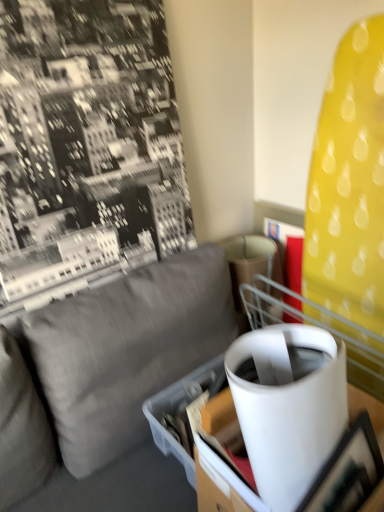
This screenshot has width=384, height=512. Describe the element at coordinates (220, 486) in the screenshot. I see `white glossy table at center` at that location.

Identify the location of matte black picture frame at lower right. This screenshot has height=512, width=384. (348, 472).

The width and height of the screenshot is (384, 512). What do you see at coordinates (182, 409) in the screenshot?
I see `cardboard box at center` at bounding box center [182, 409].

Locate an element on the screen. This screenshot has height=512, width=384. white glossy table at center is located at coordinates (220, 486).

Is white glossy table at center touching cardboard box at center?

No.

Is white glossy table at center looking in the opposite direction of cardboard box at center?

Correct, white glossy table at center is looking away from cardboard box at center.

Which is correct: white glossy table at center is inside cardboard box at center, or outside of it?

white glossy table at center lies outside cardboard box at center.

At what (x,y) coordinates should I click in order to perform the action: click on cardboard box below the white glossy table at center (from the image's perspective). Please return your answer as a coordinate pair (x, y). The width and height of the screenshot is (384, 512). Looking at the image, I should click on (182, 409).

What's the angular difference between matte black picture frame at lower right and gray fabric couch at center's facing directions?

The angle between the facing direction of matte black picture frame at lower right and the facing direction of gray fabric couch at center is 0.946 degrees.

Which is more to the right, matte black picture frame at lower right or gray fabric couch at center?

Positioned to the right is matte black picture frame at lower right.

From the picture: From the image's perspective, which one is positioned lower, matte black picture frame at lower right or gray fabric couch at center?

gray fabric couch at center is shown below in the image.

At what (x,y) coordinates should I click in order to perform the action: click on picture frame that is behind the gray fabric couch at center. Please return your answer as a coordinate pair (x, y). Looking at the image, I should click on (348, 472).

Can you confirm if matte black picture frame at lower right is smaller than cardboard box at center?

Yes, matte black picture frame at lower right is smaller than cardboard box at center.

Which point is more forward, [355,451] or [169,389]?

The point [355,451] is closer.

Which object is further away from the camera, matte black picture frame at lower right or cardboard box at center?

cardboard box at center is behind.

Can we say matte black picture frame at lower right lies outside cardboard box at center?

Yes, matte black picture frame at lower right is outside of cardboard box at center.

From a real-world perspective, who is located lower, gray fabric couch at center or cardboard box at center?

In real-world perspective, gray fabric couch at center is lower.

Which object is closer to the camera taking this photo, gray fabric couch at center or cardboard box at center?

gray fabric couch at center is more forward.

The height and width of the screenshot is (512, 384). In order to click on cardboard box behind the gray fabric couch at center in this screenshot , I will do `click(182, 409)`.

Is gray fabric couch at center oriented towards matte black picture frame at lower right?

Yes, gray fabric couch at center is facing matte black picture frame at lower right.

Does gray fabric couch at center have a lesser width compared to matte black picture frame at lower right?

In fact, gray fabric couch at center might be wider than matte black picture frame at lower right.

Considering the points (154, 386) and (355, 454), which point is in front, point (154, 386) or point (355, 454)?

The point (355, 454) is closer.

In the scene shown: Does gray fabric couch at center have a larger size compared to matte black picture frame at lower right?

Yes.

Is gray fabric couch at center in front of or behind white glossy table at center in the image?

In the image, gray fabric couch at center appears in front of white glossy table at center.

Find the location of `studio couch that appears in front of the white glossy table at center`. studio couch that appears in front of the white glossy table at center is located at coordinates (123, 379).

Are gray fabric couch at center and white glossy table at center making contact?

There is a gap between gray fabric couch at center and white glossy table at center.

Is gray fabric couch at center thinner than white glossy table at center?

Incorrect, the width of gray fabric couch at center is not less than that of white glossy table at center.

Measure the distance between white glossy table at center and matte black picture frame at lower right.

white glossy table at center is 8.49 inches away from matte black picture frame at lower right.

Is white glossy table at center facing towards matte black picture frame at lower right?

Yes.

Can you confirm if white glossy table at center is wider than matte black picture frame at lower right?

Correct, the width of white glossy table at center exceeds that of matte black picture frame at lower right.

Is white glossy table at center situated inside matte black picture frame at lower right or outside?

white glossy table at center is spatially positioned inside matte black picture frame at lower right.

Identify the location of cardboard box behind the white glossy table at center. (182, 409).

Where is `picture frame positioned vertically above the gray fabric couch at center (from a real-world perspective)`? picture frame positioned vertically above the gray fabric couch at center (from a real-world perspective) is located at coordinates (348, 472).

Estimate the real-world distances between objects in this image. Which object is closer to matte black picture frame at lower right, cardboard box at center or gray fabric couch at center?

cardboard box at center lies closer to matte black picture frame at lower right than the other object.

Which object lies nearer to the anchor point white glossy table at center, matte black picture frame at lower right or gray fabric couch at center?

Based on the image, matte black picture frame at lower right appears to be nearer to white glossy table at center.

From the image, which object appears to be nearer to gray fabric couch at center, white glossy table at center or matte black picture frame at lower right?

white glossy table at center lies closer to gray fabric couch at center than the other object.

Considering their positions, is cardboard box at center positioned closer to white glossy table at center than matte black picture frame at lower right?

cardboard box at center is positioned closer to the anchor white glossy table at center.

Considering their positions, is white glossy table at center positioned closer to gray fabric couch at center than cardboard box at center?

Based on the image, cardboard box at center appears to be nearer to gray fabric couch at center.

Estimate the real-world distances between objects in this image. Which object is closer to white glossy table at center, matte black picture frame at lower right or cardboard box at center?

Based on the image, cardboard box at center appears to be nearer to white glossy table at center.

Estimate the real-world distances between objects in this image. Which object is closer to cardboard box at center, gray fabric couch at center or matte black picture frame at lower right?

Among the two, gray fabric couch at center is located nearer to cardboard box at center.

Based on their spatial positions, is cardboard box at center or matte black picture frame at lower right closer to gray fabric couch at center?

The object closer to gray fabric couch at center is cardboard box at center.

The image size is (384, 512). In order to click on picture frame between white glossy table at center and cardboard box at center in the front-back direction in this screenshot , I will do `click(348, 472)`.

Where is `table between gray fabric couch at center and matte black picture frame at lower right in the front-back direction`? This screenshot has height=512, width=384. table between gray fabric couch at center and matte black picture frame at lower right in the front-back direction is located at coordinates (220, 486).

At what (x,y) coordinates should I click in order to perform the action: click on picture frame located between gray fabric couch at center and cardboard box at center in the depth direction. Please return your answer as a coordinate pair (x, y). Looking at the image, I should click on (348, 472).

The width and height of the screenshot is (384, 512). What are the coordinates of `table positioned between gray fabric couch at center and cardboard box at center from near to far` in the screenshot? It's located at pyautogui.click(x=220, y=486).